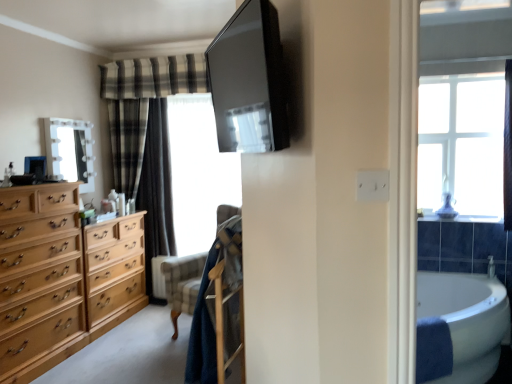
This screenshot has width=512, height=384. Describe the element at coordinates (467, 320) in the screenshot. I see `white glossy bathtub at lower right` at that location.

Where is `white glossy mirror at upper left`? The image size is (512, 384). white glossy mirror at upper left is located at coordinates (70, 150).

You are a GUI agent. You are given a task and a screenshot of the screen. Output one action in this format:
    pyautogui.click(x=<x>, y=<y>)
    Task: Click on the transparent plastic window screen at center
    The image size is (512, 384).
    Given the screenshot: What is the action you would take?
    pyautogui.click(x=198, y=172)

The width and height of the screenshot is (512, 384). Identify the location of white glossy bathtub at lower right. (467, 320).

Considering the relative sizes of white glossy mirror at upper left and plaid fabric curtain at left in the image provided, is white glossy mirror at upper left wider than plaid fabric curtain at left?

Incorrect, the width of white glossy mirror at upper left does not surpass that of plaid fabric curtain at left.

From the image's perspective, is white glossy mirror at upper left beneath plaid fabric curtain at left?

Actually, white glossy mirror at upper left appears above plaid fabric curtain at left in the image.

What are the coordinates of `curtain that is below the white glossy mirror at upper left (from the image's perspective)` in the screenshot? It's located at (156, 190).

Is point (229, 179) behind point (468, 353)?

Yes, it is.

Is transparent plastic window screen at center taller or shorter than white glossy bathtub at lower right?

transparent plastic window screen at center is taller than white glossy bathtub at lower right.

Can we say transparent plastic window screen at center lies outside white glossy bathtub at lower right?

That's correct, transparent plastic window screen at center is outside of white glossy bathtub at lower right.

Consider the image. Considering the relative sizes of transparent plastic window screen at center and white glossy bathtub at lower right in the image provided, is transparent plastic window screen at center thinner than white glossy bathtub at lower right?

Indeed, transparent plastic window screen at center has a lesser width compared to white glossy bathtub at lower right.

The image size is (512, 384). I want to click on mirror on the left of transparent plastic window screen at center, so click(x=70, y=150).

Is transparent plastic window screen at center to the left of white glossy mirror at upper left from the viewer's perspective?

In fact, transparent plastic window screen at center is to the right of white glossy mirror at upper left.

From a real-world perspective, is transparent plastic window screen at center physically below white glossy mirror at upper left?

Yes, from a real-world perspective, transparent plastic window screen at center is below white glossy mirror at upper left.

From the image's perspective, is transparent plastic window screen at center over white glossy mirror at upper left?

Incorrect, from the image's perspective, transparent plastic window screen at center is lower than white glossy mirror at upper left.

Are light brown wood chest of drawers at left and plaid fabric curtain at left beside each other?

No, light brown wood chest of drawers at left is not with plaid fabric curtain at left.

Does light brown wood chest of drawers at left appear on the left side of plaid fabric curtain at left?

Correct, you'll find light brown wood chest of drawers at left to the left of plaid fabric curtain at left.

Find the location of a particular element. The width and height of the screenshot is (512, 384). curtain that is above the light brown wood chest of drawers at left (from a real-world perspective) is located at coordinates (156, 190).

Consider the image. Is light brown wood chest of drawers at left facing away from plaid fabric curtain at left?

No, plaid fabric curtain at left is not at the back of light brown wood chest of drawers at left.

Which is nearer, [479,346] or [150,127]?

Point [479,346] is closer to the camera than point [150,127].

From the image's perspective, is white glossy bathtub at lower right below plaid fabric curtain at left?

Yes, from the image's perspective, white glossy bathtub at lower right is below plaid fabric curtain at left.

Is white glossy bathtub at lower right looking in the opposite direction of plaid fabric curtain at left?

No.

Is white glossy bathtub at lower right far away from plaid fabric curtain at left?

white glossy bathtub at lower right is positioned a significant distance from plaid fabric curtain at left.

Is plaid fabric curtain at left to the left or to the right of transparent plastic window screen at center in the image?

plaid fabric curtain at left is positioned on transparent plastic window screen at center's left side.

Is plaid fabric curtain at left smaller than transparent plastic window screen at center?

No, plaid fabric curtain at left is not smaller than transparent plastic window screen at center.

From the image's perspective, is plaid fabric curtain at left located beneath transparent plastic window screen at center?

Yes, from the image's perspective, plaid fabric curtain at left is beneath transparent plastic window screen at center.

Is plaid fabric curtain at left not close to transparent plastic window screen at center?

No, there isn't a large distance between plaid fabric curtain at left and transparent plastic window screen at center.

From the image's perspective, is white glossy mirror at upper left positioned above or below white glossy bathtub at lower right?

From the image's perspective, white glossy mirror at upper left appears above white glossy bathtub at lower right.

Is white glossy mirror at upper left oriented towards white glossy bathtub at lower right?

Yes, white glossy mirror at upper left faces towards white glossy bathtub at lower right.

Is white glossy mirror at upper left to the left or to the right of white glossy bathtub at lower right in the image?

In the image, white glossy mirror at upper left appears on the left side of white glossy bathtub at lower right.

You are a GUI agent. You are given a task and a screenshot of the screen. Output one action in this format:
    pyautogui.click(x=<x>, y=<y>)
    Task: Click on the curtain that appears below the white glossy mirror at upper left (from a real-world perspective)
    The height and width of the screenshot is (384, 512).
    Given the screenshot: What is the action you would take?
    pyautogui.click(x=156, y=190)

Find the location of `bath below the transparent plastic window screen at center (from the image's perspective)`. bath below the transparent plastic window screen at center (from the image's perspective) is located at coordinates (467, 320).

When comparing their distances from velvet-like beige armchair at center, does white glossy mirror at upper left or light brown wood dresser at left seem closer?

The object closer to velvet-like beige armchair at center is light brown wood dresser at left.

Looking at the image, which one is located closer to light brown wood chest of drawers at left, white glossy mirror at upper left or white glossy bathtub at lower right?

white glossy mirror at upper left.

Looking at the image, which one is located further to light brown wood dresser at left, light brown wood chest of drawers at left or plaid fabric curtain at left?

The object further to light brown wood dresser at left is plaid fabric curtain at left.

Which object lies further to the anchor point transparent plastic window screen at center, light brown wood dresser at left or plaid fabric curtain at left?

light brown wood dresser at left is further to transparent plastic window screen at center.

From the image, which object appears to be nearer to light brown wood chest of drawers at left, white glossy mirror at upper left or velvet-like beige armchair at center?

Based on the image, velvet-like beige armchair at center appears to be nearer to light brown wood chest of drawers at left.

Looking at the image, which one is located further to light brown wood dresser at left, velvet-like beige armchair at center or plaid fabric curtain at left?

velvet-like beige armchair at center is positioned further to the anchor light brown wood dresser at left.

Considering their positions, is transparent plastic window screen at center positioned closer to light brown wood dresser at left than plaid fabric curtain at left?

plaid fabric curtain at left is positioned closer to the anchor light brown wood dresser at left.

Looking at the image, which one is located further to transparent plastic window screen at center, white glossy bathtub at lower right or velvet-like beige armchair at center?

white glossy bathtub at lower right lies further to transparent plastic window screen at center than the other object.

At what (x,y) coordinates should I click in order to perform the action: click on curtain between light brown wood chest of drawers at left and white glossy bathtub at lower right from left to right. Please return your answer as a coordinate pair (x, y). This screenshot has width=512, height=384. Looking at the image, I should click on (156, 190).

Locate an element on the screen. cabinetry between white glossy mirror at upper left and white glossy bathtub at lower right in the horizontal direction is located at coordinates (114, 266).

You are a GUI agent. You are given a task and a screenshot of the screen. Output one action in this format:
    pyautogui.click(x=<x>, y=<y>)
    Task: Click on the armchair situated between light brown wood chest of drawers at left and white glossy bathtub at lower right from left to right
    This screenshot has height=384, width=512.
    Given the screenshot: What is the action you would take?
    pyautogui.click(x=182, y=284)

You are a GUI agent. You are given a task and a screenshot of the screen. Output one action in this format:
    pyautogui.click(x=<x>, y=<y>)
    Task: Click on the curtain between white glossy mirror at upper left and white glossy bathtub at lower right in the horizontal direction
    
    Given the screenshot: What is the action you would take?
    pyautogui.click(x=156, y=190)